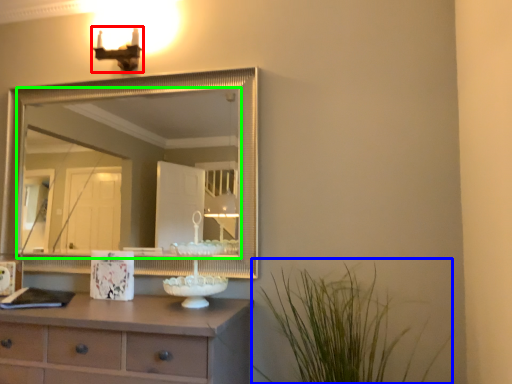
Question: Estimate the real-world distances between objects in this image. Which object is closer to light fixture (highlighted by a red box), plant (highlighted by a blue box) or mirror (highlighted by a green box)?

Choices:
 (A) plant
 (B) mirror

Answer: (A)